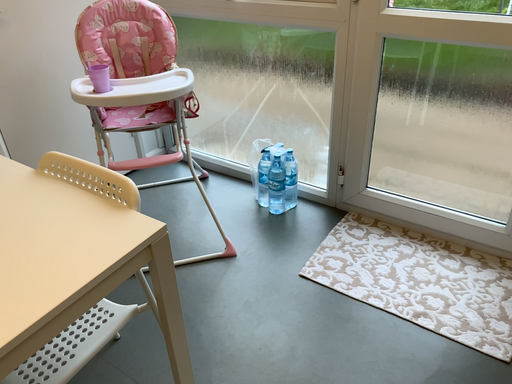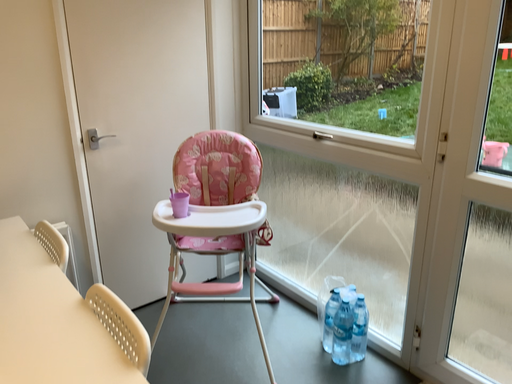
Question: Which way did the camera rotate in the video?

Choices:
 (A) rotated left
 (B) rotated right

Answer: (A)